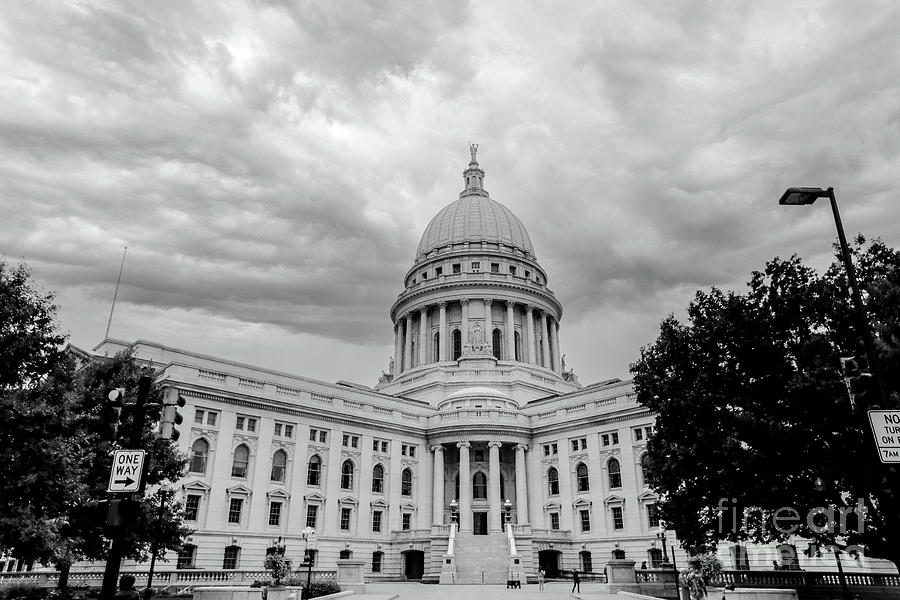
Locate an element on the screen. columns by main antrance is located at coordinates (436, 457), (436, 511), (472, 517), (464, 458), (496, 454), (491, 519), (529, 503), (519, 450).